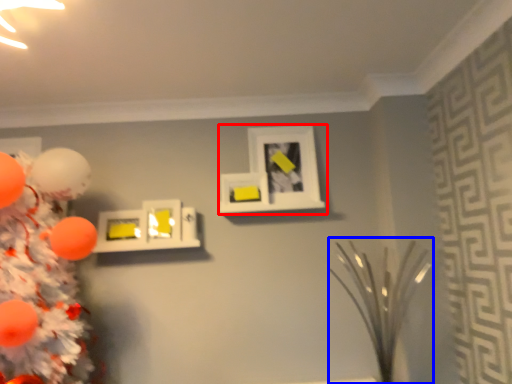
Question: Which object appears closest to the camera in this image, picture frame (highlighted by a red box) or plant (highlighted by a blue box)?

Choices:
 (A) picture frame
 (B) plant

Answer: (B)